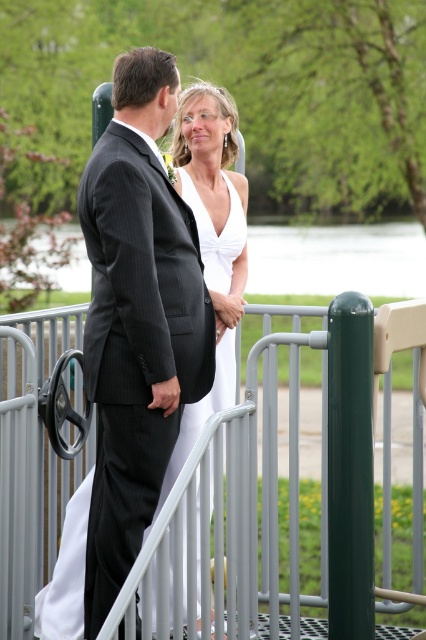
Can you confirm if silver metallic railing at center is positioned to the left of white satin dress at center?

No, silver metallic railing at center is not to the left of white satin dress at center.

Is silver metallic railing at center bigger than white satin dress at center?

Yes.

What do you see at coordinates (244, 509) in the screenshot? Image resolution: width=426 pixels, height=640 pixels. I see `silver metallic railing at center` at bounding box center [244, 509].

Where is `silver metallic railing at center`? silver metallic railing at center is located at coordinates (244, 509).

Who is shorter, silver metallic railing at center or matte black suit at center?

With less height is silver metallic railing at center.

Can you confirm if silver metallic railing at center is smaller than matte black suit at center?

Incorrect, silver metallic railing at center is not smaller in size than matte black suit at center.

What do you see at coordinates (244, 509) in the screenshot? The width and height of the screenshot is (426, 640). I see `silver metallic railing at center` at bounding box center [244, 509].

Where is `silver metallic railing at center`? The width and height of the screenshot is (426, 640). silver metallic railing at center is located at coordinates click(x=244, y=509).

Who is shorter, matte black suit at center or white satin dress at center?

With less height is white satin dress at center.

Between matte black suit at center and white satin dress at center, which one is positioned lower?

white satin dress at center is lower down.

What do you see at coordinates (137, 321) in the screenshot? This screenshot has width=426, height=640. I see `matte black suit at center` at bounding box center [137, 321].

Identify the location of matte black suit at center. (137, 321).